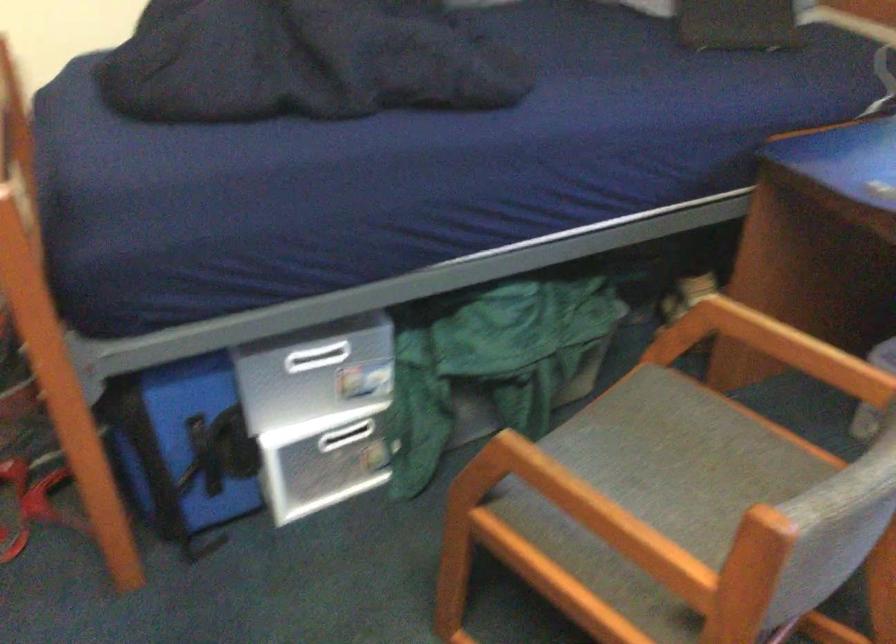
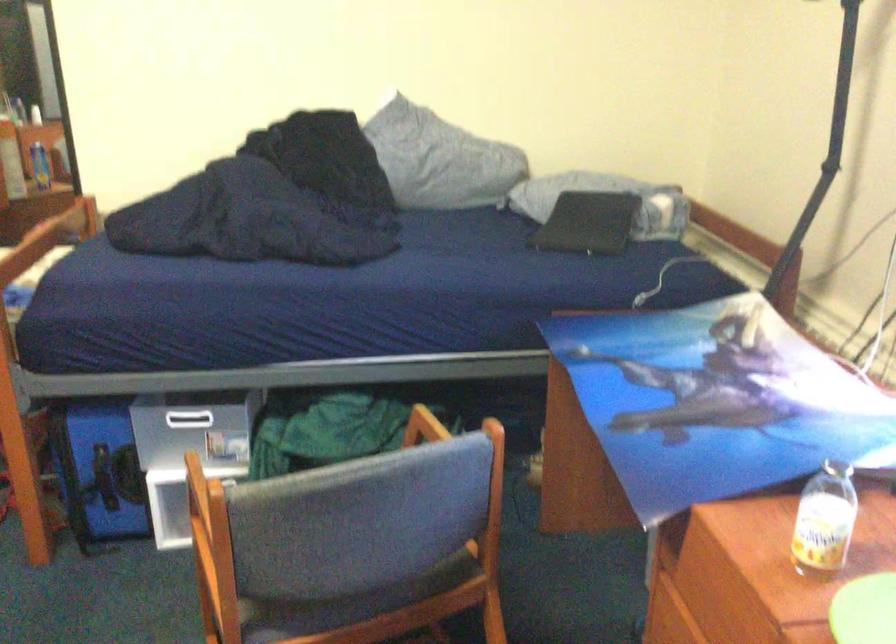
Which direction would the cameraman need to move to produce the second image?

The cameraman walked toward right, backward.